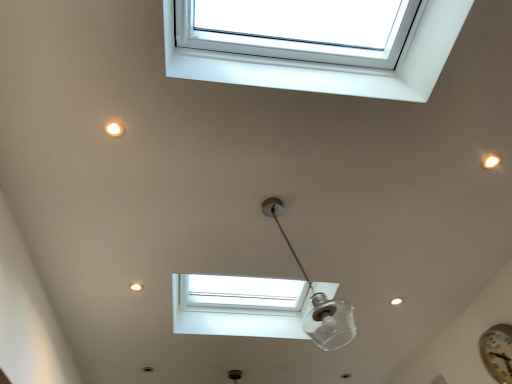
What is the approximate height of transparent glass lamp at center?

It is 27.86 inches.

The image size is (512, 384). What do you see at coordinates (333, 65) in the screenshot?
I see `white plastic window at upper center` at bounding box center [333, 65].

Find the location of `transparent glass lamp at center`. transparent glass lamp at center is located at coordinates (319, 301).

Is transparent glass lamp at center located within white plastic window at upper center?

No, transparent glass lamp at center is not a part of white plastic window at upper center.

Is white plastic window at upper center next to transparent glass lamp at center and touching it?

No, white plastic window at upper center is not with transparent glass lamp at center.

From a real-world perspective, is white plastic window at upper center positioned above or below transparent glass lamp at center?

white plastic window at upper center is situated higher than transparent glass lamp at center in the real world.

Is metallic silver clock at lower right positioned behind transparent glass lamp at center?

Yes.

Considering the positions of objects metallic silver clock at lower right and transparent glass lamp at center in the image provided, who is more to the right, metallic silver clock at lower right or transparent glass lamp at center?

metallic silver clock at lower right.

From the picture: Are metallic silver clock at lower right and transparent glass lamp at center making contact?

metallic silver clock at lower right and transparent glass lamp at center are not in contact.

Is metallic silver clock at lower right oriented away from transparent glass lamp at center?

metallic silver clock at lower right is not turned away from transparent glass lamp at center.

Does transparent glass lamp at center touch metallic silver clock at lower right?

No, transparent glass lamp at center is not next to metallic silver clock at lower right.

Which object is closer to the camera taking this photo, transparent glass lamp at center or metallic silver clock at lower right?

transparent glass lamp at center is in front.

Locate an element on the screen. This screenshot has width=512, height=384. lamp in front of the metallic silver clock at lower right is located at coordinates (319, 301).

In the scene shown: Can you confirm if transparent glass lamp at center is smaller than metallic silver clock at lower right?

Actually, transparent glass lamp at center might be larger than metallic silver clock at lower right.

From a real-world perspective, who is located lower, white plastic window at upper center or metallic silver clock at lower right?

From a 3D spatial view, metallic silver clock at lower right is below.

In the scene shown: Does white plastic window at upper center have a lesser width compared to metallic silver clock at lower right?

No, white plastic window at upper center is not thinner than metallic silver clock at lower right.

Is white plastic window at upper center bigger or smaller than metallic silver clock at lower right?

In the image, white plastic window at upper center appears to be larger than metallic silver clock at lower right.

How different are the orientations of transparent glass lamp at center and white plastic window at upper center in degrees?

There is a 88.1-degree angle between the facing directions of transparent glass lamp at center and white plastic window at upper center.

From a real-world perspective, is transparent glass lamp at center located beneath white plastic window at upper center?

Indeed, from a real-world perspective, transparent glass lamp at center is positioned beneath white plastic window at upper center.

Between transparent glass lamp at center and white plastic window at upper center, which one has less height?

Standing shorter between the two is white plastic window at upper center.

Based on their sizes in the image, would you say metallic silver clock at lower right is bigger or smaller than white plastic window at upper center?

In the image, metallic silver clock at lower right appears to be smaller than white plastic window at upper center.

What's the angular difference between metallic silver clock at lower right and white plastic window at upper center's facing directions?

The angle between the facing direction of metallic silver clock at lower right and the facing direction of white plastic window at upper center is 87.7 degrees.

From the image's perspective, is metallic silver clock at lower right located above white plastic window at upper center?

No, from the image's perspective, metallic silver clock at lower right is not on top of white plastic window at upper center.

Choose the correct answer: Is metallic silver clock at lower right inside white plastic window at upper center or outside it?

metallic silver clock at lower right lies outside white plastic window at upper center.

There is a transparent glass lamp at center. In order to click on window above it (from a real-world perspective) in this screenshot , I will do `click(333, 65)`.

Find the location of a particular element. lamp that appears on the left of metallic silver clock at lower right is located at coordinates (319, 301).

Based on their spatial positions, is transparent glass lamp at center or white plastic window at upper center further from metallic silver clock at lower right?

white plastic window at upper center.

Based on their spatial positions, is white plastic window at upper center or transparent glass lamp at center further from metallic silver clock at lower right?

The object further to metallic silver clock at lower right is white plastic window at upper center.

When comparing their distances from transparent glass lamp at center, does white plastic window at upper center or metallic silver clock at lower right seem closer?

metallic silver clock at lower right is positioned closer to the anchor transparent glass lamp at center.

Based on the photo, from the image, which object appears to be farther from white plastic window at upper center, metallic silver clock at lower right or transparent glass lamp at center?

metallic silver clock at lower right is further to white plastic window at upper center.

Which object lies nearer to the anchor point white plastic window at upper center, transparent glass lamp at center or metallic silver clock at lower right?

transparent glass lamp at center is positioned closer to the anchor white plastic window at upper center.

Estimate the real-world distances between objects in this image. Which object is closer to transparent glass lamp at center, metallic silver clock at lower right or white plastic window at upper center?

metallic silver clock at lower right.

This screenshot has height=384, width=512. I want to click on lamp between white plastic window at upper center and metallic silver clock at lower right in the up-down direction, so click(319, 301).